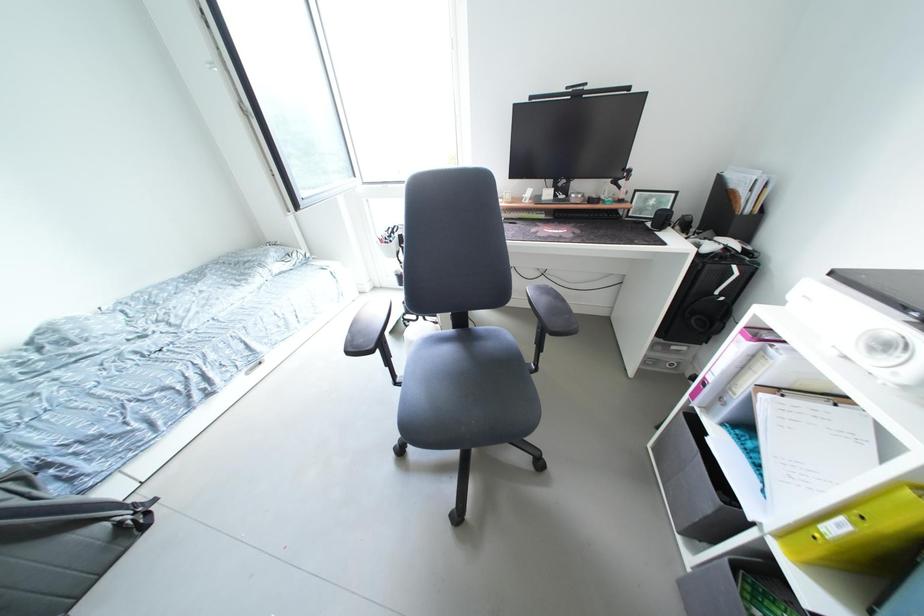
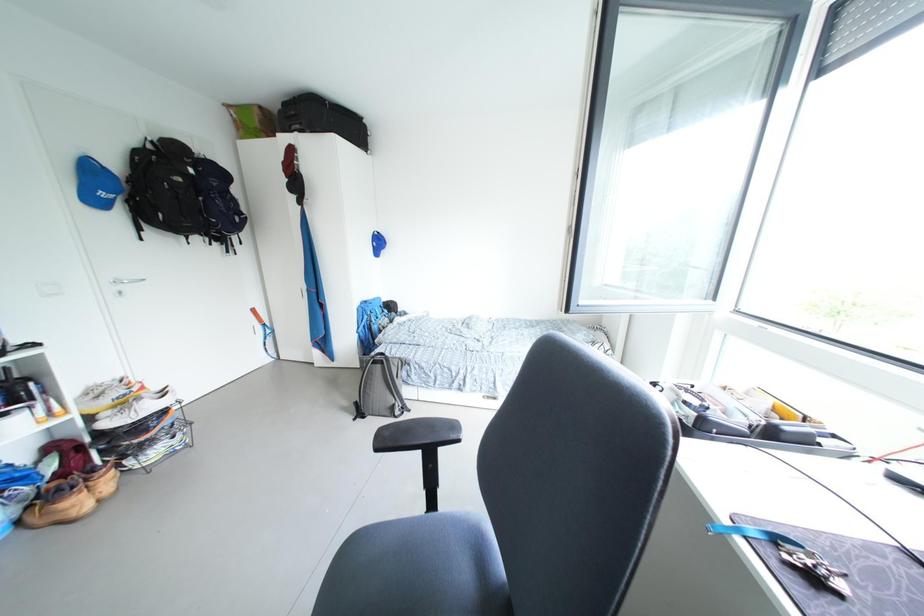
Question: How did the camera likely rotate?

Choices:
 (A) Left
 (B) Right
 (C) Up
 (D) Down

Answer: (A)